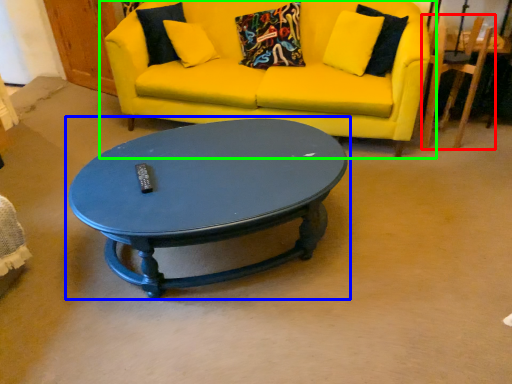
Question: Estimate the real-world distances between objects in this image. Which object is closer to armchair (highlighted by a red box), coffee table (highlighted by a blue box) or studio couch (highlighted by a green box)?

Choices:
 (A) coffee table
 (B) studio couch

Answer: (B)